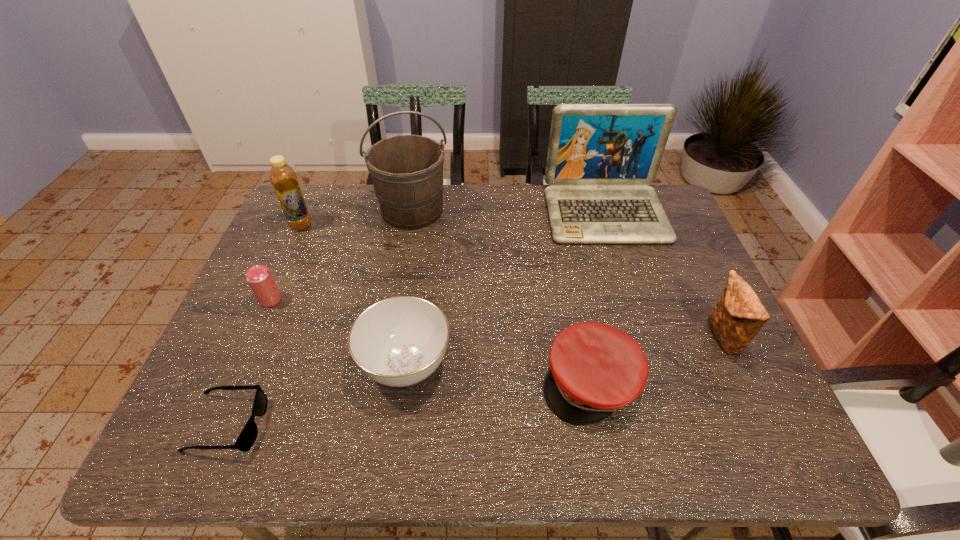
Locate an element on the screen. This screenshot has width=960, height=540. bottle that is at the far edge is located at coordinates (283, 177).

The width and height of the screenshot is (960, 540). I want to click on cap present at the near edge, so click(596, 369).

Find the location of a particular element. The height and width of the screenshot is (540, 960). sunglasses located at the near edge is located at coordinates (246, 439).

Locate an element on the screen. bottle present at the left edge is located at coordinates (283, 177).

The width and height of the screenshot is (960, 540). Find the location of `beer can at the left edge`. beer can at the left edge is located at coordinates (259, 277).

Find the location of a particular element. The image size is (960, 540). sunglasses that is positioned at the left edge is located at coordinates (246, 439).

I want to click on laptop computer located in the right edge section of the desktop, so click(601, 157).

I want to click on clutch bag at the right edge, so click(x=739, y=315).

The image size is (960, 540). Find the location of `object that is positioned at the far left corner`. object that is positioned at the far left corner is located at coordinates (283, 177).

What are the coordinates of `object that is at the near left corner` in the screenshot? It's located at (246, 439).